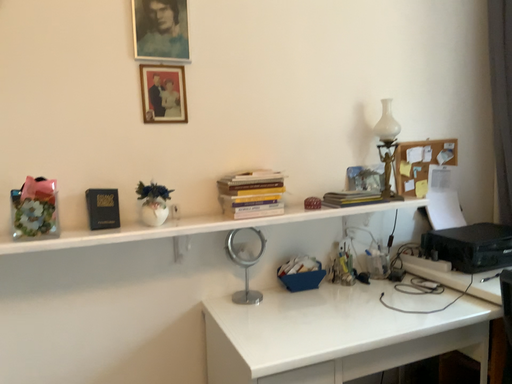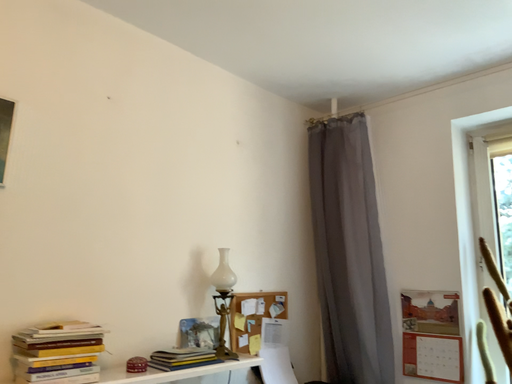
Question: Which way did the camera rotate in the video?

Choices:
 (A) rotated left
 (B) rotated right

Answer: (B)